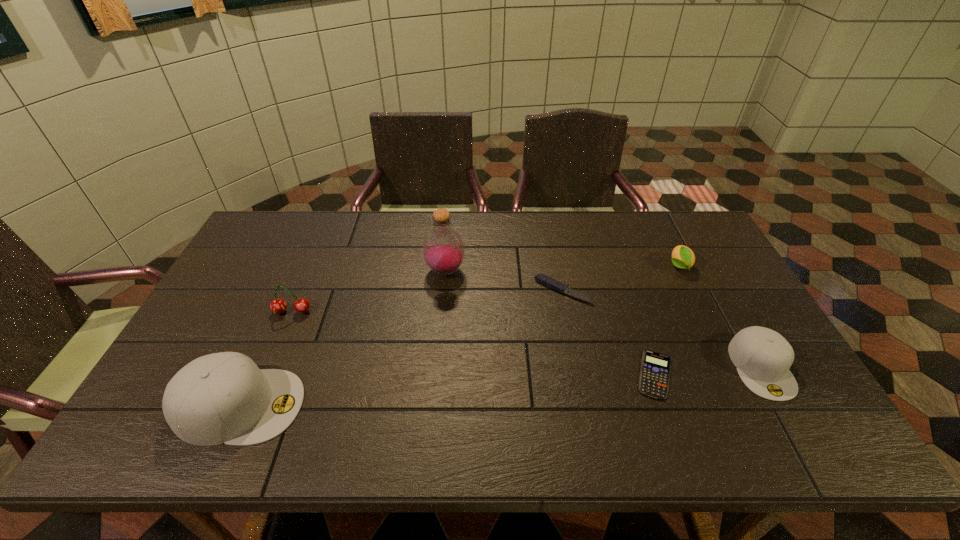
In order to click on the taller cap in this screenshot , I will do `click(224, 397)`.

The image size is (960, 540). I want to click on the second tallest object, so click(x=224, y=397).

What are the coordinates of `the shorter cap` in the screenshot? It's located at (763, 357).

The height and width of the screenshot is (540, 960). What are the coordinates of `the third tallest object` in the screenshot? It's located at (278, 305).

Identify the location of the third shortest object. This screenshot has height=540, width=960. (683, 257).

This screenshot has height=540, width=960. In order to click on steak knife in this screenshot , I will do `click(544, 279)`.

Identify the location of the fourth object from right to left. (544, 279).

The height and width of the screenshot is (540, 960). Find the location of `bottle`. bottle is located at coordinates (443, 249).

Image resolution: width=960 pixels, height=540 pixels. Identify the location of the tallest object. (443, 249).

Locate an element on the screen. calculator is located at coordinates (654, 377).